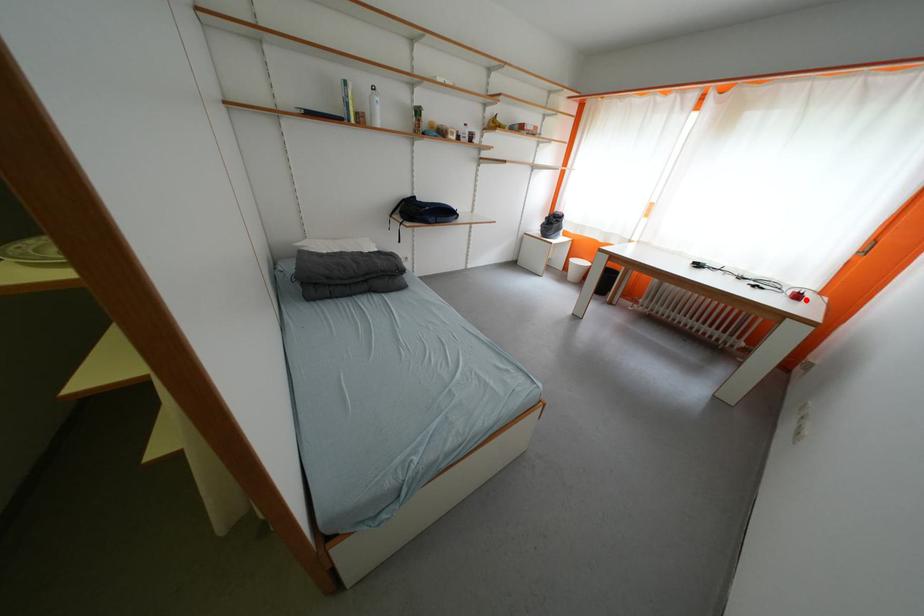
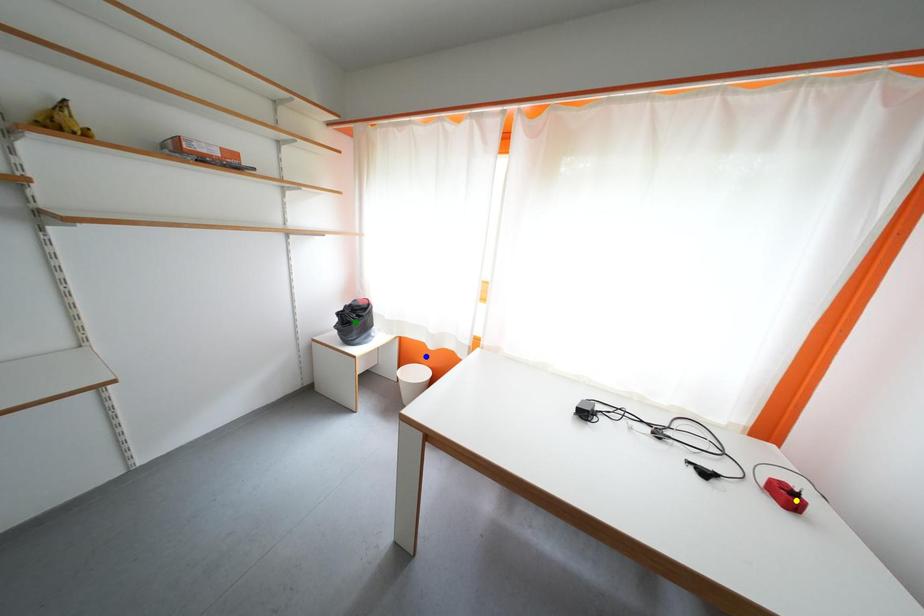
Question: I am providing you with two images of the same scene from different viewpoints. A red point is marked on the first image. You are given multiple points on the second image. Which point in image 2 is actually the same real-world point as the red point in image 1?

Choices:
 (A) blue point
 (B) yellow point
 (C) green point

Answer: (B)